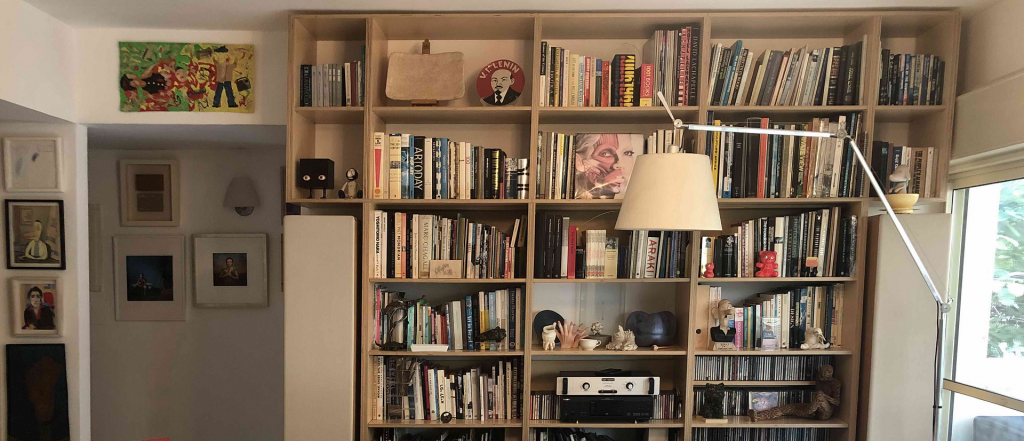
The width and height of the screenshot is (1024, 441). I want to click on lamp, so click(x=939, y=309).